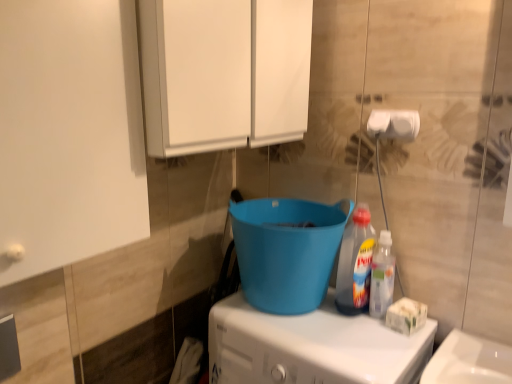
The image size is (512, 384). Identify the location of blank space situated above white plastic washing machine at lower center (from a real-world perspective). (318, 331).